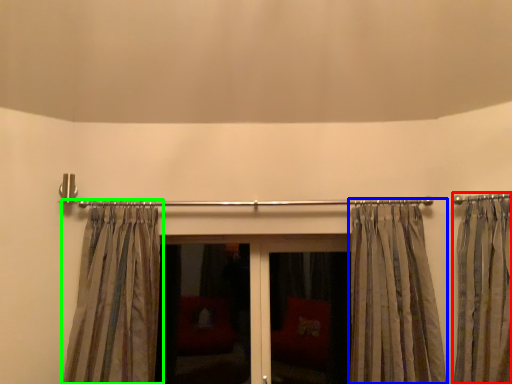
Question: Estimate the real-world distances between objects in this image. Which object is farther from curtain (highlighted by a red box), curtain (highlighted by a blue box) or curtain (highlighted by a green box)?

Choices:
 (A) curtain
 (B) curtain

Answer: (B)